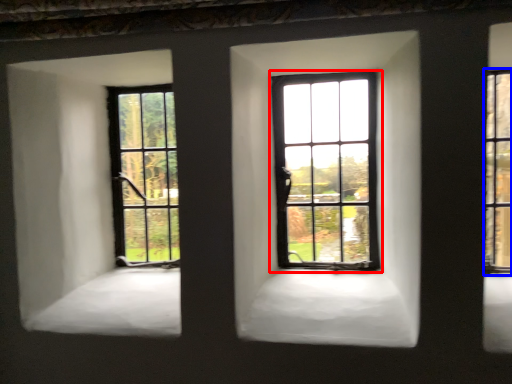
Question: Among these objects, which one is nearest to the camera, window (highlighted by a red box) or window (highlighted by a blue box)?

Choices:
 (A) window
 (B) window

Answer: (B)